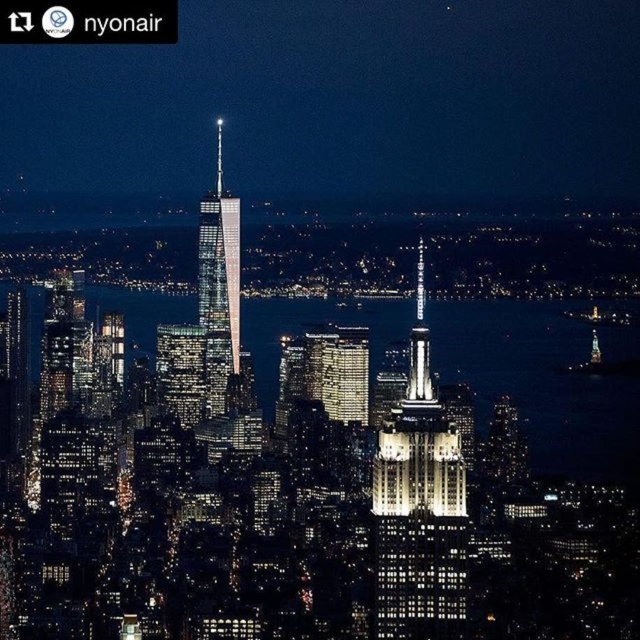
You are a drone operator tasked with capturing aerial footage of the city. Your drone is currently positioned at the coordinates given in the scene description. If you want to focus your camera on the white marble tower at center, which direction should you adjust your drone to move?

The white marble tower at center is located at point [419,506], so you should adjust your drone to move towards those coordinates to focus on the tower.

You are an architect analyzing the cityscape. You notice the white marble tower at center and the glassy reflective skyscraper at center. Which one appears nearer to you in the image?

The white marble tower at center is closer to the viewer than the glassy reflective skyscraper at center.

You are a tourist standing in the city square and want to take a photo of both the white marble tower at center and the glassy reflective skyscraper at center. Which one should you position to your left to capture both in the frame?

You should position the glassy reflective skyscraper at center to your left because the white marble tower at center is to the right of it.